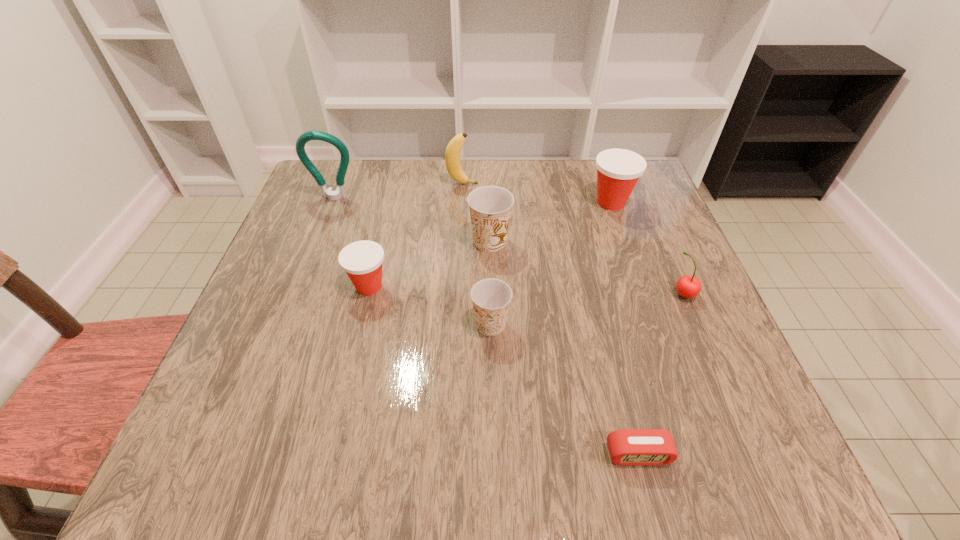
Locate an element on the screen. Image resolution: width=960 pixels, height=540 pixels. vacant space that is in between the third farthest Dixie cup and the rightmost object is located at coordinates (526, 290).

Find the location of a particular element. The image size is (960, 540). vacant point located between the farthest object and the nearer orange Dixie cup is located at coordinates coord(476,254).

You are a GUI agent. You are given a task and a screenshot of the screen. Output one action in this format:
    pyautogui.click(x=<x>, y=<y>)
    Task: Click on the free space between the banana and the farther red-orange Dixie cup
    Image resolution: width=960 pixels, height=540 pixels.
    Given the screenshot: What is the action you would take?
    pyautogui.click(x=537, y=193)

Locate an element on the screen. unoccupied position between the farther orange Dixie cup and the cherry is located at coordinates (587, 268).

At what (x,y) coordinates should I click in order to perform the action: click on unoccupied area between the second farthest Dixie cup and the rightmost object. Please return your answer as a coordinate pair (x, y). Image resolution: width=960 pixels, height=540 pixels. Looking at the image, I should click on (587, 268).

Find the location of a particular element. free space between the rightmost object and the bottle opener is located at coordinates (509, 246).

Find the location of a particular element. object that stands as the second closest to the alarm clock is located at coordinates (688, 286).

You are a GUI agent. You are given a task and a screenshot of the screen. Output one action in this format:
    pyautogui.click(x=<x>, y=<y>)
    Task: Click on the object that is the fourth nearest to the farthest Dixie cup
    This screenshot has height=540, width=960.
    Given the screenshot: What is the action you would take?
    pyautogui.click(x=491, y=297)

This screenshot has height=540, width=960. Find the location of `Dixie cup that is the closest to the left red-orange Dixie cup`. Dixie cup that is the closest to the left red-orange Dixie cup is located at coordinates (490, 207).

Identify which Dixie cup is the third nearest to the farther red-orange Dixie cup. Please provide its 2D coordinates. Your answer should be formatted as a tuple, i.e. [(x, y)], where the tuple contains the x and y coordinates of a point satisfying the conditions above.

[(362, 261)]